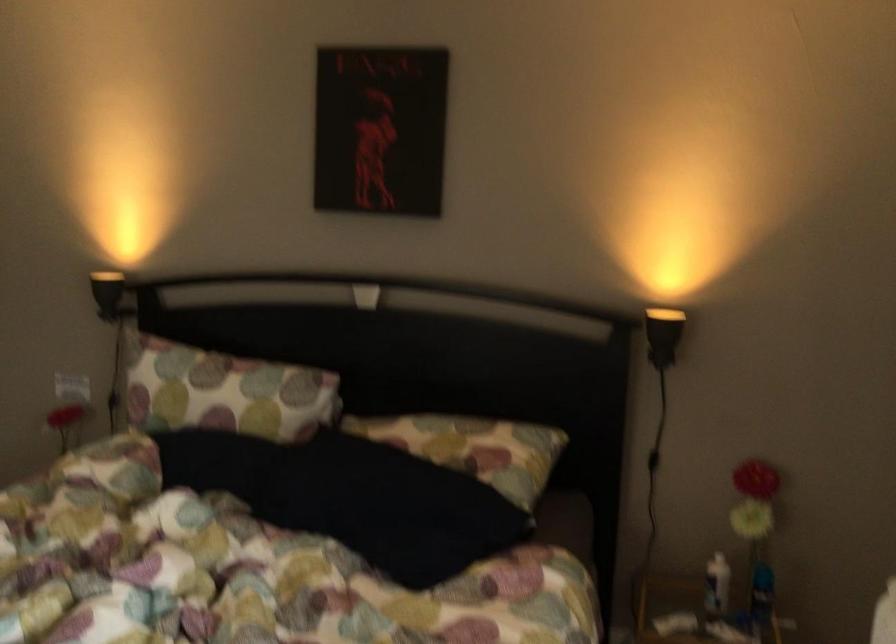
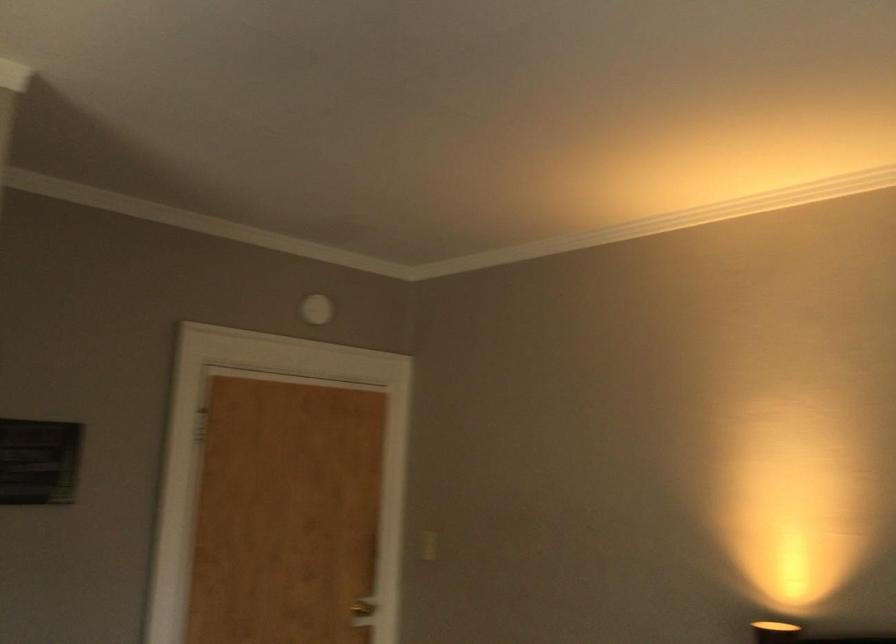
The images are taken continuously from a first-person perspective. In which direction is your viewpoint rotating?

The rotation direction of the camera is left-up.